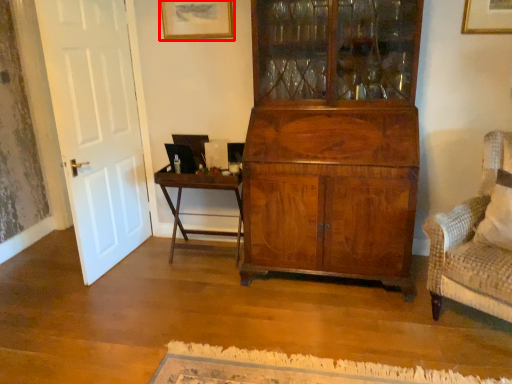
Question: From the image, what is the correct spatial relationship of picture frame (annotated by the red box) in relation to table?

Choices:
 (A) left
 (B) right

Answer: (A)